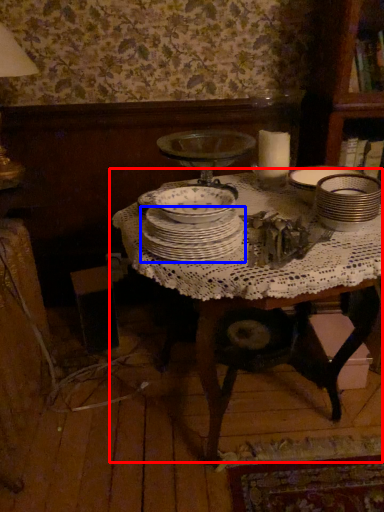
Question: Which object is closer to the camera taking this photo, table (highlighted by a red box) or plate (highlighted by a blue box)?

Choices:
 (A) table
 (B) plate

Answer: (A)